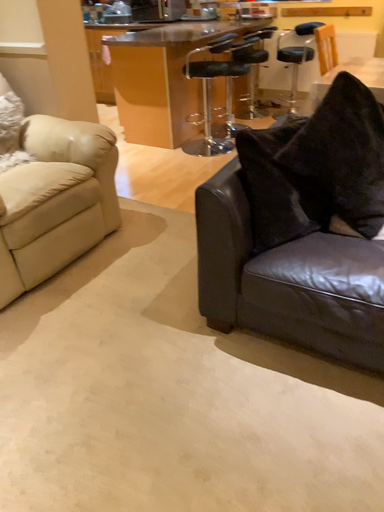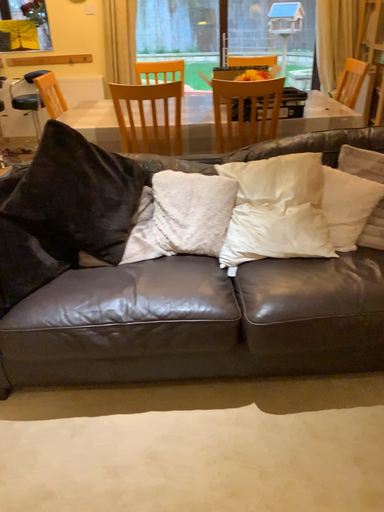
Question: How did the camera likely rotate when shooting the video?

Choices:
 (A) rotated right
 (B) rotated left

Answer: (A)